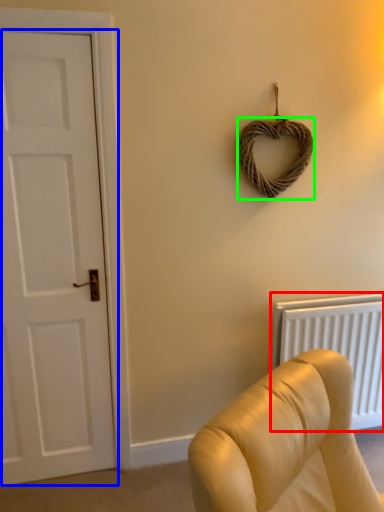
Question: Estimate the real-world distances between objects in this image. Which object is farther from radiator (highlighted by a red box), door (highlighted by a blue box) or rope (highlighted by a green box)?

Choices:
 (A) door
 (B) rope

Answer: (A)